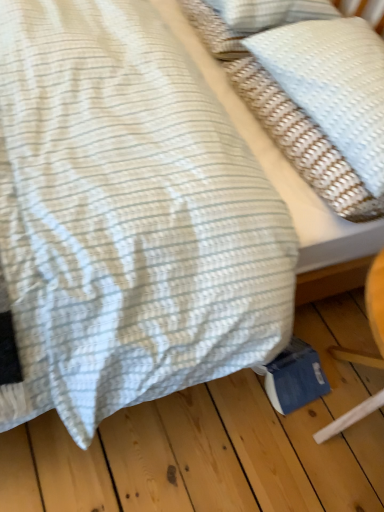
Question: Should I look upward or downward to see white textured pillow at upper right?

Choices:
 (A) down
 (B) up

Answer: (B)